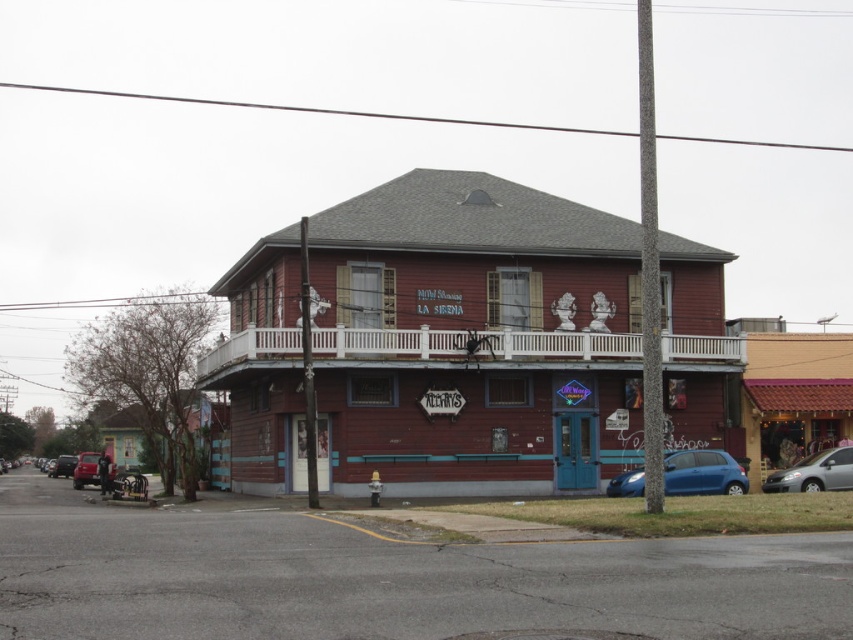
Question: Which point is closer to the camera taking this photo?

Choices:
 (A) (837, 484)
 (B) (86, 454)

Answer: (A)

Question: Does silver metallic van at lower right appear over metallic red car at lower left?

Choices:
 (A) no
 (B) yes

Answer: (B)

Question: Does matte blue car at lower right have a greater width compared to metallic red car at lower left?

Choices:
 (A) no
 (B) yes

Answer: (A)

Question: Among these points, which one is farthest from the camera?

Choices:
 (A) (67, 476)
 (B) (84, 461)

Answer: (A)

Question: Which object is farther from the camera taking this photo?

Choices:
 (A) matte blue car at lower right
 (B) metallic red car at lower left
 (C) silver metallic van at lower right

Answer: (B)

Question: Is matte blue car at lower right thinner than silver metallic van at lower right?

Choices:
 (A) yes
 (B) no

Answer: (A)